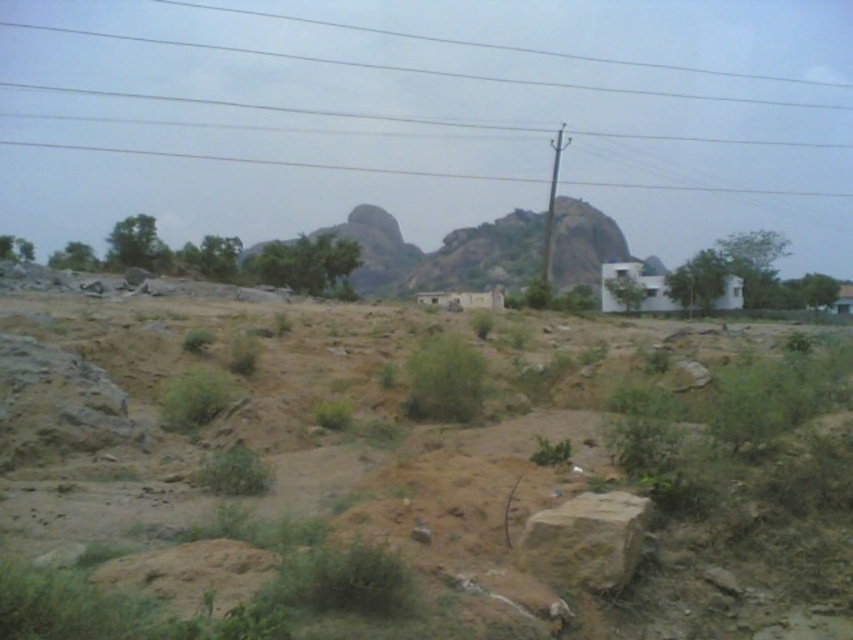
Image resolution: width=853 pixels, height=640 pixels. In order to click on brown sandy dirt field at center in this screenshot , I will do `click(410, 474)`.

Can you confirm if brown sandy dirt field at center is positioned to the left of brown rough rock at center?

No, brown sandy dirt field at center is not to the left of brown rough rock at center.

Which is behind, point (270, 476) or point (618, 588)?

The point (270, 476) is behind.

The height and width of the screenshot is (640, 853). I want to click on brown sandy dirt field at center, so click(x=410, y=474).

Which is more to the left, brown sandy dirt field at center or smooth wire at upper center?

Positioned to the left is smooth wire at upper center.

Who is shorter, brown sandy dirt field at center or smooth wire at upper center?

brown sandy dirt field at center is shorter.

Does point (370, 321) lie behind point (682, 184)?

No, (370, 321) is in front of (682, 184).

The width and height of the screenshot is (853, 640). I want to click on brown sandy dirt field at center, so click(x=410, y=474).

Describe the element at coordinates (279, 108) in the screenshot. I see `smooth wire at upper center` at that location.

Consider the image. Is smooth wire at upper center further to camera compared to green grass at center?

Yes, it is.

Which is in front, point (463, 173) or point (419, 378)?

Point (419, 378) is in front.

This screenshot has width=853, height=640. What are the coordinates of `smooth wire at upper center` in the screenshot? It's located at (279, 108).